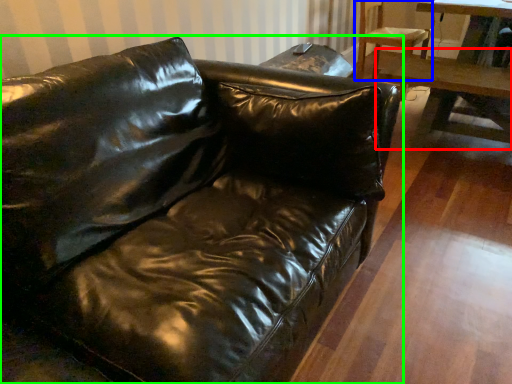
Question: Which object is the farthest from table (highlighted by a red box)? Choose among these: chair (highlighted by a blue box) or studio couch (highlighted by a green box).

Choices:
 (A) chair
 (B) studio couch

Answer: (B)